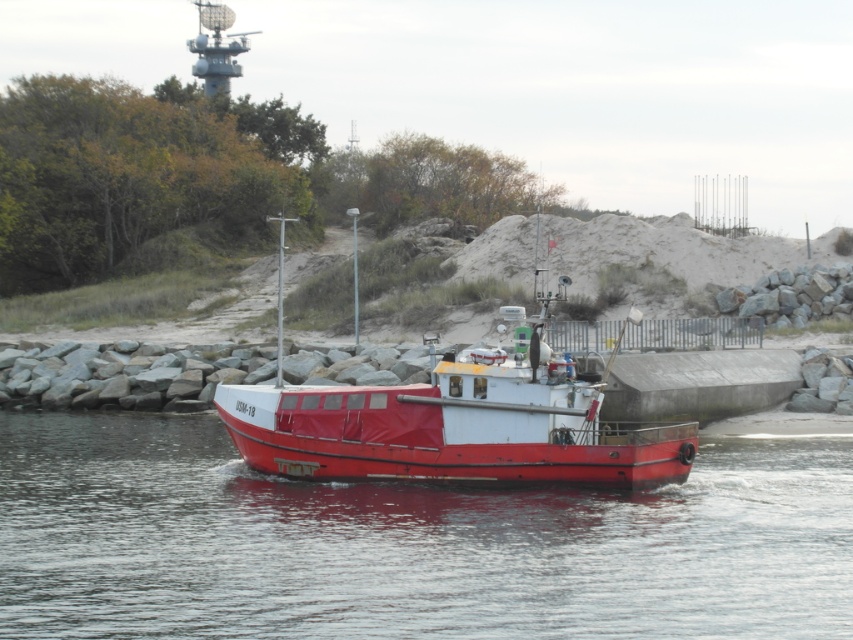
Question: Among these points, which one is nearest to the camera?

Choices:
 (A) (437, 522)
 (B) (363, 388)

Answer: (A)

Question: Is smooth water at boat center further to camera compared to red matte boat at center?

Choices:
 (A) yes
 (B) no

Answer: (B)

Question: Is smooth water at boat center to the left of red matte boat at center from the viewer's perspective?

Choices:
 (A) yes
 (B) no

Answer: (B)

Question: From the image, what is the correct spatial relationship of smooth water at boat center in relation to red matte boat at center?

Choices:
 (A) right
 (B) left

Answer: (A)

Question: Which object appears farthest from the camera in this image?

Choices:
 (A) smooth water at boat center
 (B) red matte boat at center

Answer: (B)